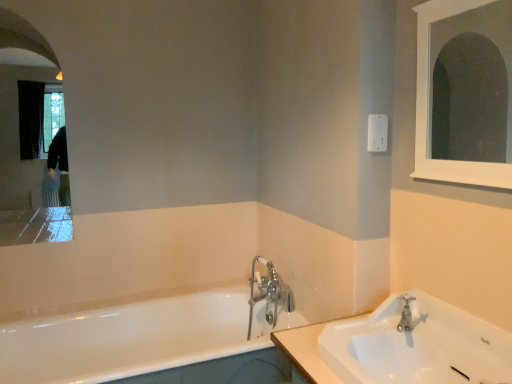
Question: In terms of width, does white plastic electric outlet at upper right look wider or thinner when compared to silver metallic faucet at sink right, the 1th tap from the right?

Choices:
 (A) thin
 (B) wide

Answer: (A)

Question: From the image's perspective, relative to silver metallic faucet at sink right, the 1th tap from the right, is white plastic electric outlet at upper right above or below?

Choices:
 (A) below
 (B) above

Answer: (B)

Question: Which of these objects is positioned closest to the white plastic electric outlet at upper right?

Choices:
 (A) white wooden medicine cabinet at upper right, placed as the first medicine cabinet when sorted from front to back
 (B) white glossy bathtub at lower left
 (C) white glossy medicine cabinet at upper left, which is the first medicine cabinet from left to right
 (D) white glossy sink at lower right
 (E) chrome metallic faucet at center, acting as the first tap starting from the back

Answer: (A)

Question: Which of these objects is positioned closest to the white glossy bathtub at lower left?

Choices:
 (A) chrome metallic faucet at center, the second tap when ordered from front to back
 (B) white wooden medicine cabinet at upper right, placed as the first medicine cabinet when sorted from front to back
 (C) silver metallic faucet at sink right, which is counted as the 1th tap, starting from the front
 (D) white glossy sink at lower right
 (E) white glossy medicine cabinet at upper left, which ranks as the second medicine cabinet in right-to-left order

Answer: (A)